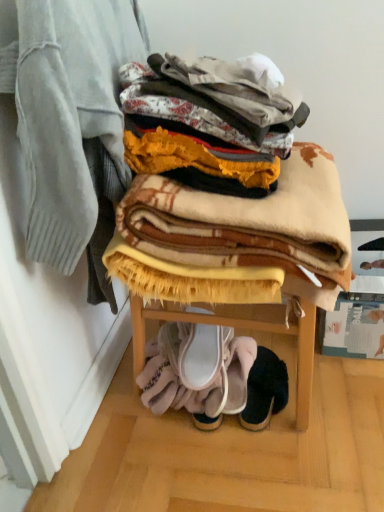
This screenshot has width=384, height=512. Identify the location of free space above black suede slipper at lower center, the 3th footwear positioned from the left (from a real-world perspective). (262, 372).